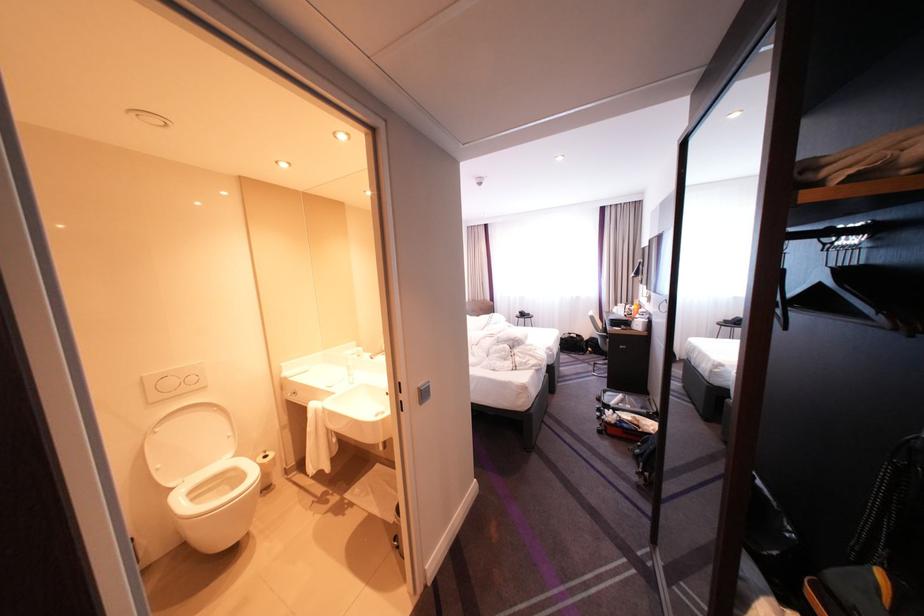
The image size is (924, 616). What do you see at coordinates (213, 487) in the screenshot? I see `a white toilet seat` at bounding box center [213, 487].